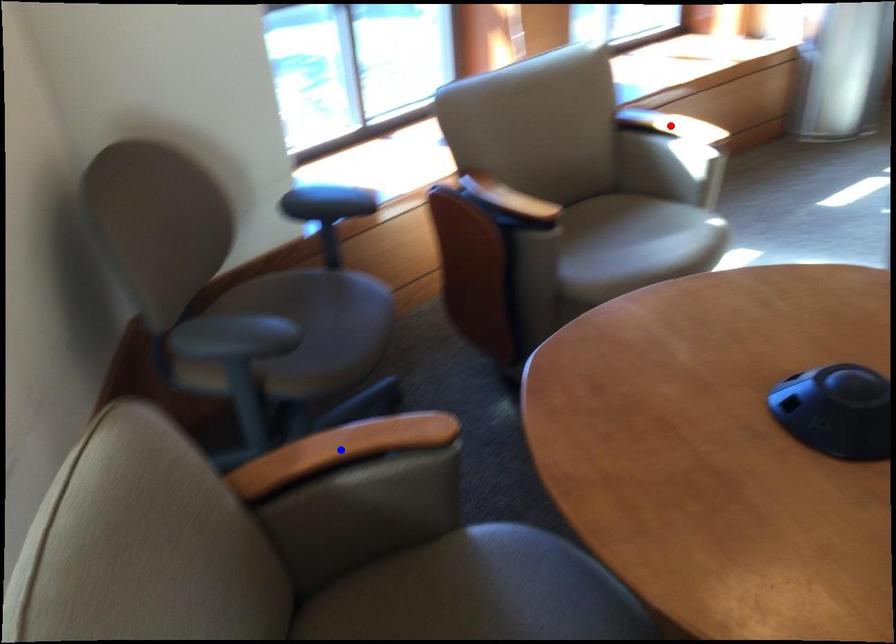
Question: In the image, two points are highlighted. Which point is nearer to the camera? Reply with the corresponding letter.

Choices:
 (A) blue point
 (B) red point

Answer: (A)